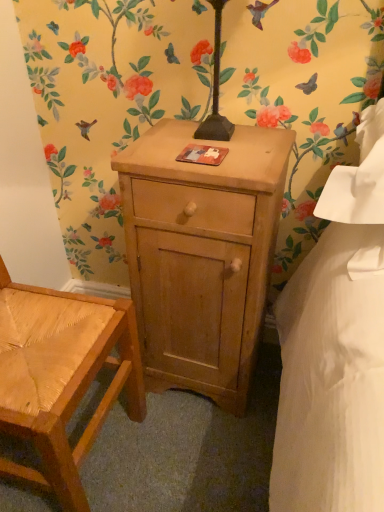
Locate an element on the screen. The width and height of the screenshot is (384, 512). vacant area on top of natural wood nightstand at center (from a real-world perspective) is located at coordinates (204, 149).